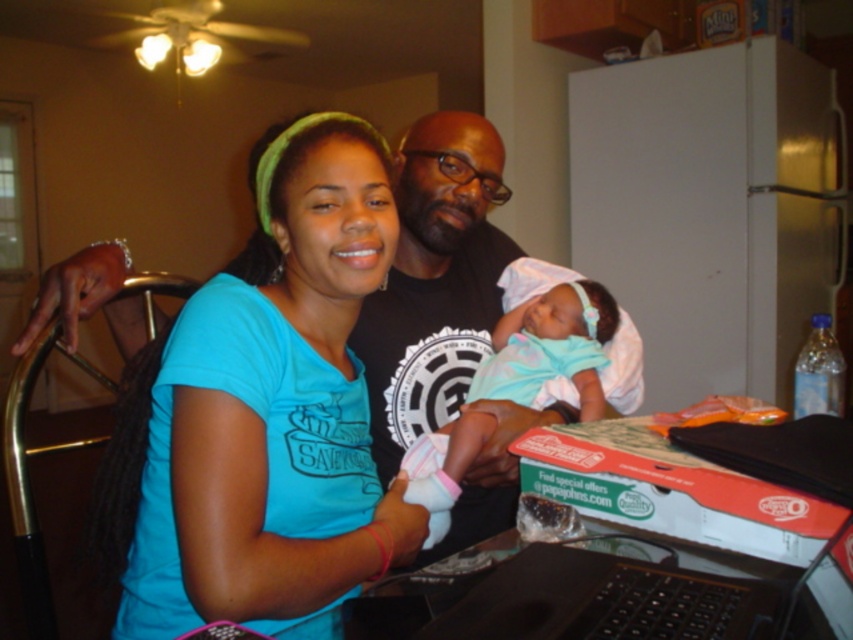
Question: Does matte blue shirt at center lie in front of light blue fabric at center?

Choices:
 (A) no
 (B) yes

Answer: (B)

Question: Which object is farther from the camera taking this photo?

Choices:
 (A) light blue fabric at center
 (B) matte blue shirt at center

Answer: (A)

Question: Which point is farther to the camera?

Choices:
 (A) (569, 444)
 (B) (312, 120)
 (C) (521, 339)

Answer: (C)

Question: Is matte blue shirt at center closer to the viewer compared to cardboard pizza box at lower right?

Choices:
 (A) no
 (B) yes

Answer: (A)

Question: Does matte blue shirt at center have a lesser width compared to light blue fabric at center?

Choices:
 (A) no
 (B) yes

Answer: (A)

Question: Among these points, which one is nearest to the camera?

Choices:
 (A) (734, 525)
 (B) (300, 456)
 (C) (558, 333)

Answer: (A)